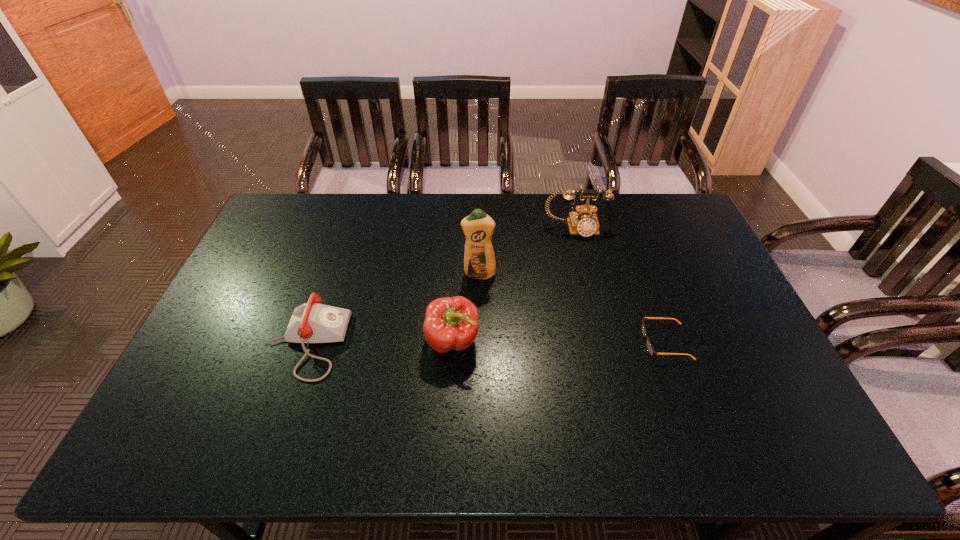
I want to click on the fourth nearest object, so click(479, 260).

You are a GUI agent. You are given a task and a screenshot of the screen. Output one action in this format:
    pyautogui.click(x=<x>, y=<y>)
    Task: Click on the tallest object
    This screenshot has height=540, width=960.
    Given the screenshot: What is the action you would take?
    pyautogui.click(x=479, y=260)

In order to click on the farthest object in this screenshot , I will do `click(583, 221)`.

Locate an element on the screen. the right telephone is located at coordinates (583, 221).

You are a GUI agent. You are given a task and a screenshot of the screen. Output one action in this format:
    pyautogui.click(x=<x>, y=<y>)
    Task: Click on the pepper
    The height and width of the screenshot is (540, 960).
    Given the screenshot: What is the action you would take?
    pyautogui.click(x=451, y=323)

Where is `the shorter telephone`? This screenshot has height=540, width=960. the shorter telephone is located at coordinates (313, 322).

You are a GUI agent. You are given a task and a screenshot of the screen. Output one action in this format:
    pyautogui.click(x=<x>, y=<y>)
    Task: Click on the left telephone
    This screenshot has width=960, height=540.
    Given the screenshot: What is the action you would take?
    pyautogui.click(x=313, y=322)

The height and width of the screenshot is (540, 960). Find the location of `spectacles`. spectacles is located at coordinates (650, 349).

Find the location of `vacant space located on the label of the detergent`. vacant space located on the label of the detergent is located at coordinates (479, 374).

At what (x,y) coordinates should I click in order to perform the action: click on blank space located 0.220m on the dial number of the farthest object. Please return your answer as a coordinate pair (x, y). This screenshot has height=540, width=960. Looking at the image, I should click on click(x=589, y=286).